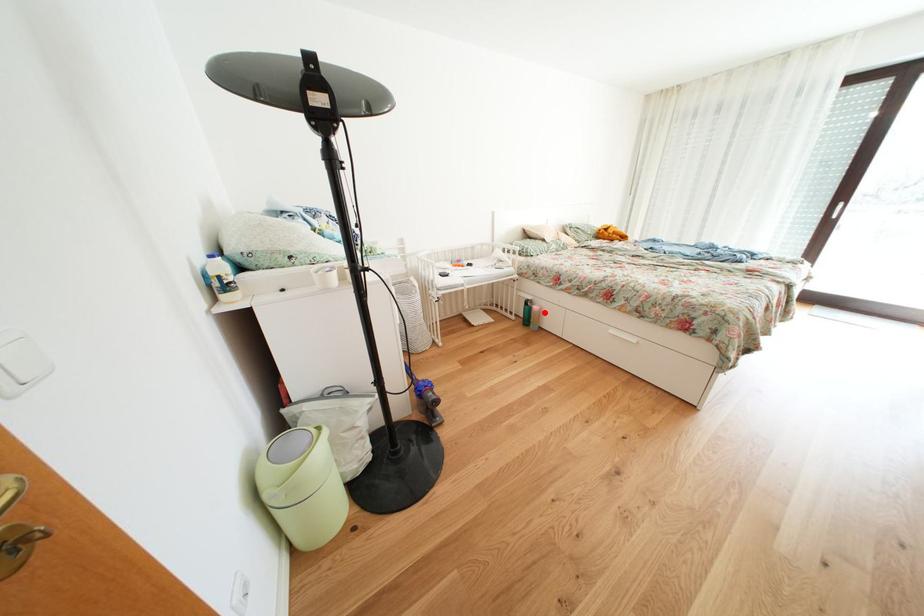
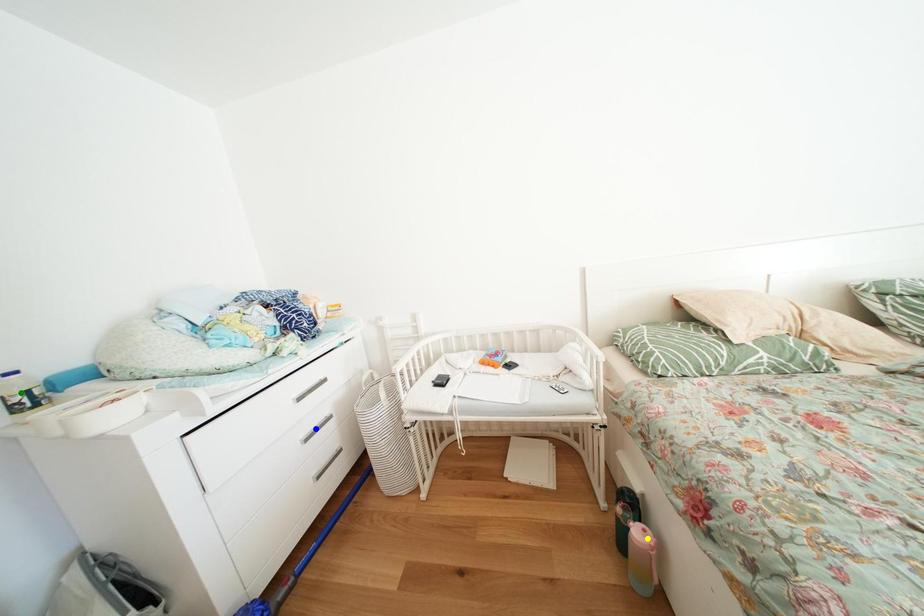
Question: I am providing you with two images of the same scene from different viewpoints. A red point is marked on the first image. You are given multiple points on the second image. Which spot in image 2 lines up with the point in image 1?

Choices:
 (A) yellow point
 (B) blue point
 (C) green point

Answer: (A)